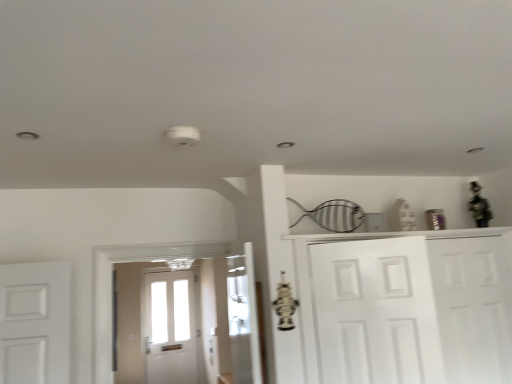
Question: Considering the positions of point (340, 273) and point (358, 339), is point (340, 273) closer or farther from the camera than point (358, 339)?

Choices:
 (A) farther
 (B) closer

Answer: (A)

Question: From their relative heights in the image, would you say white matte door at center, positioned as the first door in front-to-back order, is taller or shorter than white matte cabinet at right?

Choices:
 (A) tall
 (B) short

Answer: (B)

Question: Estimate the real-world distances between objects in this image. Which object is closer to the white matte door at center, which ranks as the second door in back-to-front order?

Choices:
 (A) white matte cabinet at right
 (B) white matte door at right, the 1th door when ordered from right to left

Answer: (A)

Question: Considering the real-world distances, which object is farthest from the white matte door at center, the 1th door from the left?

Choices:
 (A) white matte door at right, positioned as the first door in back-to-front order
 (B) white matte cabinet at right

Answer: (A)